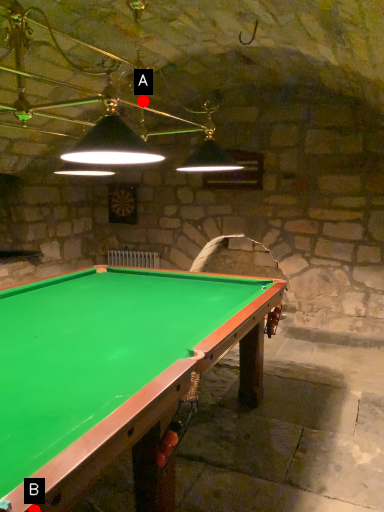
Question: Two points are circled on the image, labeled by A and B beside each circle. Which of the following is the farthest from the observer?

Choices:
 (A) A is further
 (B) B is further

Answer: (A)